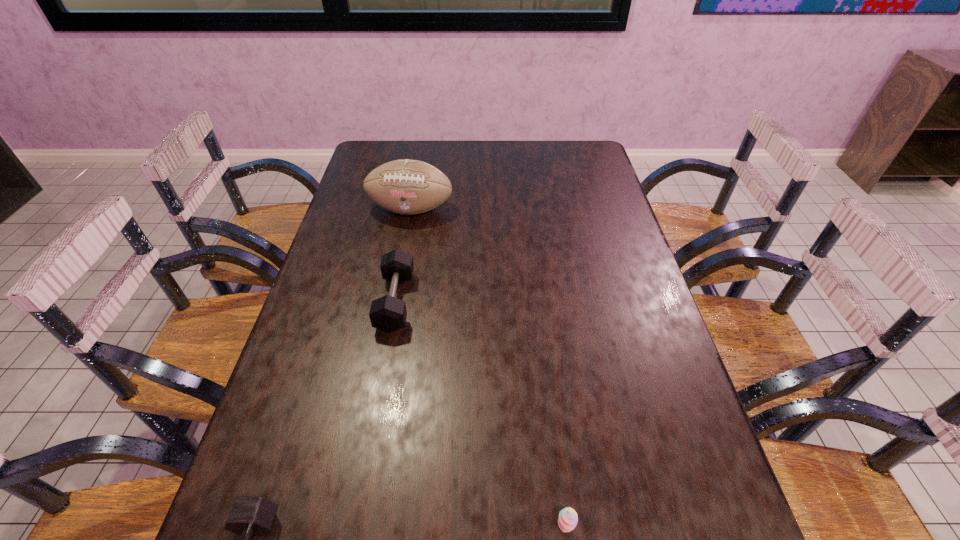
You are a GUI agent. You are given a task and a screenshot of the screen. Output one action in this format:
    pyautogui.click(x=<x>, y=<y>)
    Task: Click on the tallest object
    The width and height of the screenshot is (960, 540).
    Given the screenshot: What is the action you would take?
    pyautogui.click(x=405, y=186)

Find the location of a particular element. Image resolution: width=960 pixels, height=540 pixels. football (American) is located at coordinates (405, 186).

The image size is (960, 540). In order to click on the taller dumbbell in this screenshot , I will do `click(387, 313)`.

Identify the location of the farther dumbbell. (387, 313).

Locate an element on the screen. free space located 0.190m on the laces of the football (American) is located at coordinates (400, 267).

Locate an element on the screen. free space located 0.120m on the front of the second farthest object is located at coordinates (382, 377).

The width and height of the screenshot is (960, 540). Find the location of `object that is at the left edge`. object that is at the left edge is located at coordinates (405, 186).

In the image, there is a desktop. What are the coordinates of `free space at the far edge` in the screenshot? It's located at (407, 154).

Where is `vacant space at the left edge`? This screenshot has height=540, width=960. vacant space at the left edge is located at coordinates (382, 252).

Locate an element on the screen. vacant space at the right edge is located at coordinates (647, 480).